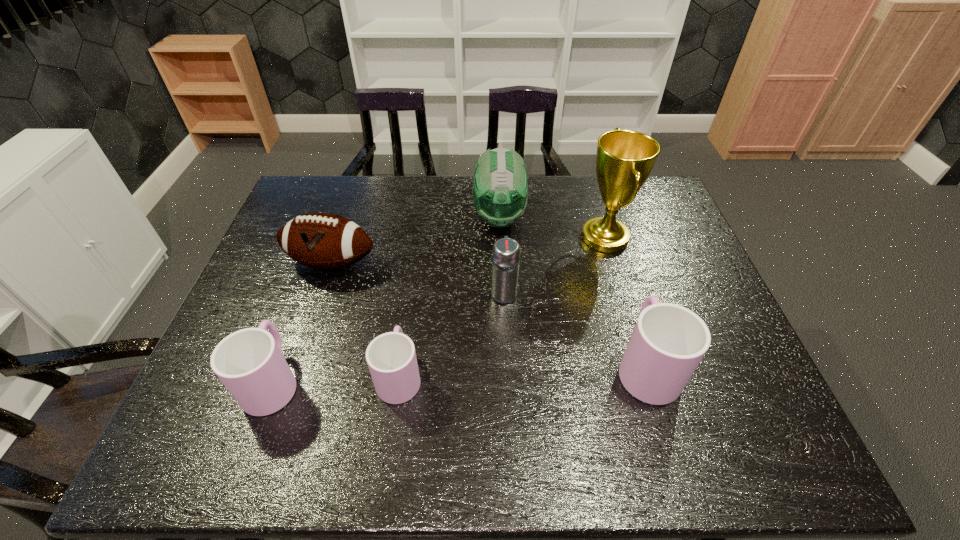
This screenshot has width=960, height=540. I want to click on vacant space at the far edge of the desktop, so [468, 188].

This screenshot has width=960, height=540. In the image, there is a desktop. Find the location of `vacant space at the near edge`. vacant space at the near edge is located at coordinates (516, 380).

What are the coordinates of `free space at the right edge of the desktop` in the screenshot? It's located at (645, 244).

At what (x,y) coordinates should I click in order to perform the action: click on vacant space at the far left corner of the desktop. Please return your answer as a coordinate pair (x, y). Looking at the image, I should click on (331, 187).

Identify the location of free space at the far right corner of the desktop. This screenshot has height=540, width=960. (664, 202).

This screenshot has height=540, width=960. What are the coordinates of `vacant space that's between the thermos bottle and the tallest object` in the screenshot? It's located at (554, 265).

Find the location of a particular element. The width and height of the screenshot is (960, 540). free space between the second cup from left to right and the sixth shortest object is located at coordinates (449, 296).

I want to click on free space between the second shortest cup and the rightmost cup, so click(460, 373).

Find the location of a particular element. vacant area that lies between the tallest object and the shortest object is located at coordinates (502, 306).

This screenshot has width=960, height=540. I want to click on free space between the rightmost cup and the second tallest object, so click(572, 291).